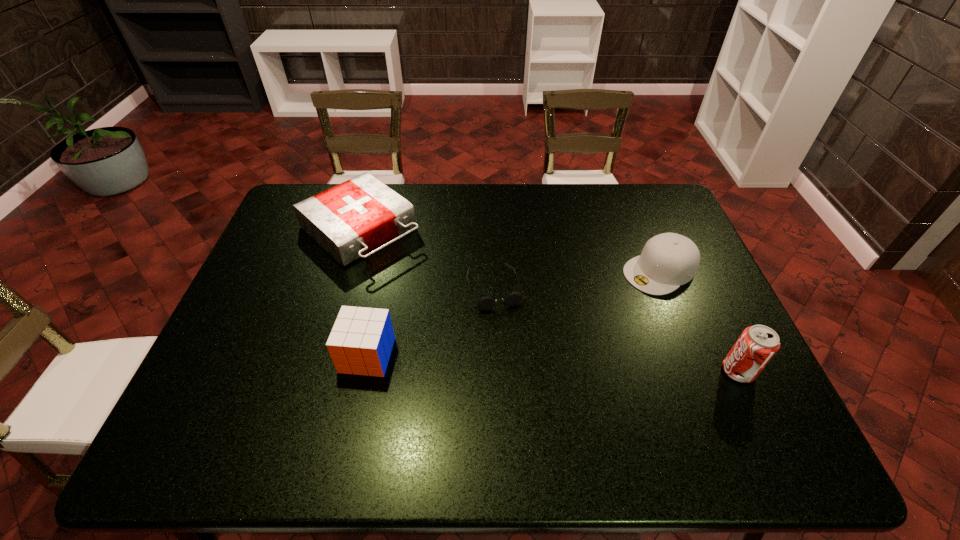
Find the location of a particular element. The image size is (960, 540). soda can that is at the right edge is located at coordinates (757, 344).

Image resolution: width=960 pixels, height=540 pixels. Identify the location of cap that is at the right edge. (668, 260).

In order to click on object that is at the far left corner in this screenshot , I will do `click(349, 220)`.

This screenshot has width=960, height=540. I want to click on object at the near right corner, so 757,344.

This screenshot has width=960, height=540. I want to click on free spot at the far edge of the desktop, so click(x=475, y=219).

The height and width of the screenshot is (540, 960). In order to click on free space at the left edge in this screenshot , I will do `click(232, 327)`.

Locate an element on the screen. This screenshot has width=960, height=540. free space at the right edge is located at coordinates (685, 237).

Locate an element on the screen. This screenshot has height=540, width=960. vacant space at the far right corner is located at coordinates (677, 218).

Locate an element on the screen. The image size is (960, 540). unoccupied area between the cube and the tallest object is located at coordinates (553, 363).

This screenshot has height=540, width=960. Identify the location of blank region between the sunglasses and the soda can. (616, 329).